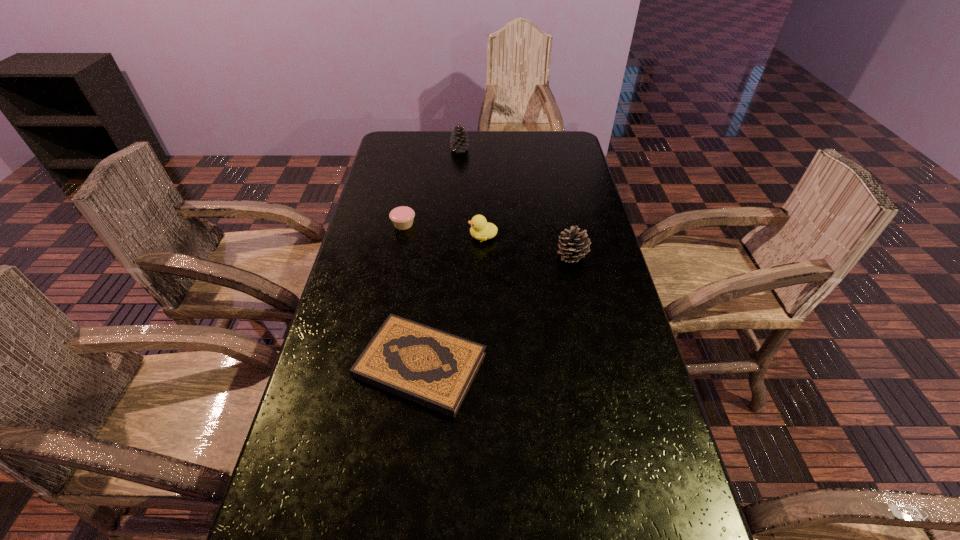
Image resolution: width=960 pixels, height=540 pixels. I want to click on free space between the duckling and the farther pinecone, so click(471, 193).

The width and height of the screenshot is (960, 540). What are the coordinates of `empty location between the left pinecone and the third tallest object` in the screenshot? It's located at (471, 193).

Where is `unoccupied area between the fourth tallest object and the nearest object`? unoccupied area between the fourth tallest object and the nearest object is located at coordinates (412, 295).

In order to click on object that stands as the closest to the third tallest object in this screenshot , I will do `click(402, 217)`.

Identify the location of object identified as the fourth closest to the fourth tallest object. (573, 246).

Find the location of a particular element. This screenshot has height=540, width=960. vacant area in the image that satisfies the following two spatial constraints: 1. on the front side of the cupcake; 2. on the right side of the nearer pinecone is located at coordinates (397, 256).

Where is `vacant point that satisfies the following two spatial constraints: 1. at the beak of the duckling; 2. on the back side of the fourth farthest object`? vacant point that satisfies the following two spatial constraints: 1. at the beak of the duckling; 2. on the back side of the fourth farthest object is located at coordinates (483, 256).

At what (x,y) coordinates should I click in order to perform the action: click on vacant area in the image that satisfies the following two spatial constraints: 1. on the front side of the right pinecone; 2. on the right side of the left pinecone. Please return your answer as a coordinate pair (x, y). Looking at the image, I should click on (453, 256).